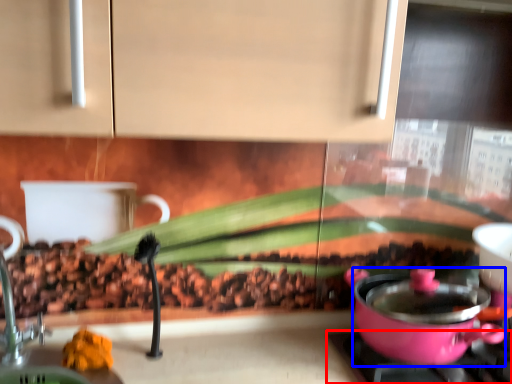
Question: Which of the following is the farthest to the observer, gas stove (highlighted by a red box) or kitchen appliance (highlighted by a blue box)?

Choices:
 (A) gas stove
 (B) kitchen appliance

Answer: (A)